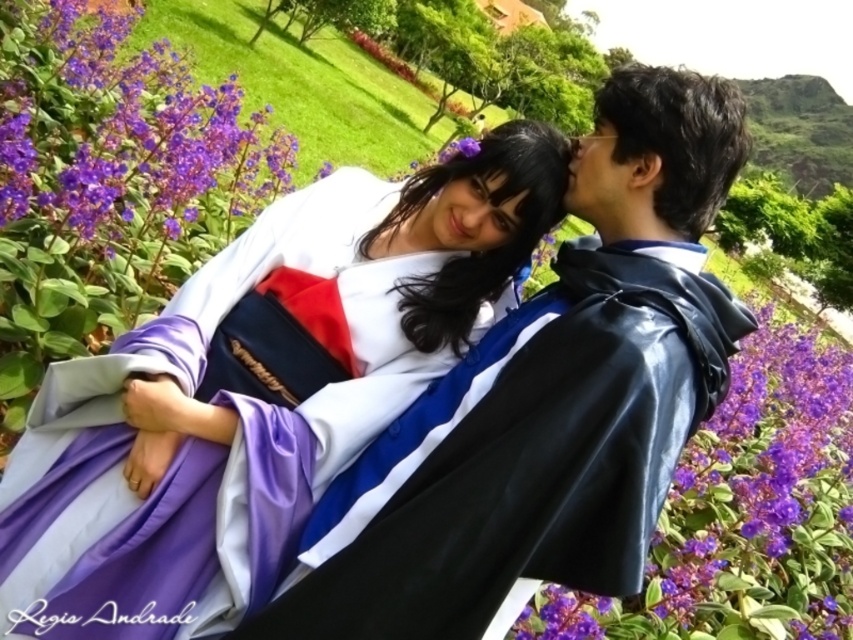
Looking at this image, you are a photographer standing at the point marked as point (97, 470). You want to take a photo of the two cosplayers in the scene. How far apart are the two cosplayers in the image?

The two cosplayers are 4.83 feet apart.

You are a photographer trying to capture the perfect shot of the satin white kimono at center. According to the coordinates provided, where exactly should you position your camera to ensure the kimono is centered in your frame?

The satin white kimono at center is located at coordinates point (259, 387), so you should position your camera directly facing that point to center it in your frame.

You are a photographer trying to capture a closeup shot of the shiny black cape at center and the purple glossy flower at lower right. Which object should you focus on first to ensure it appears sharp in your photo?

The shiny black cape at center is closer to the viewer than the purple glossy flower at lower right. To ensure the shiny black cape at center appears sharp first, focus on it since it is nearer.